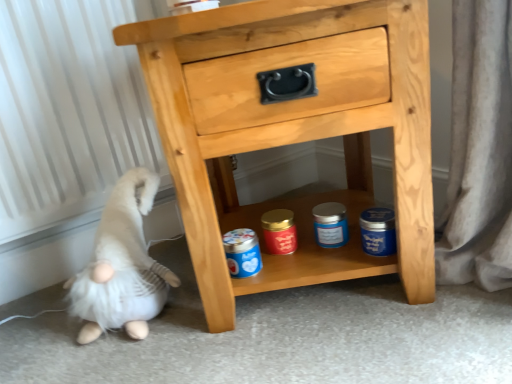
Question: Should I look upward or downward to see white plush gnome at lower left?

Choices:
 (A) down
 (B) up

Answer: (A)

Question: Is natural wood chest of drawers at center to the left of white plush gnome at lower left from the viewer's perspective?

Choices:
 (A) no
 (B) yes

Answer: (A)

Question: Considering the relative sizes of natural wood chest of drawers at center and white plush gnome at lower left in the image provided, is natural wood chest of drawers at center wider than white plush gnome at lower left?

Choices:
 (A) no
 (B) yes

Answer: (B)

Question: From a real-world perspective, is natural wood chest of drawers at center on top of white plush gnome at lower left?

Choices:
 (A) yes
 (B) no

Answer: (A)

Question: Is natural wood chest of drawers at center at the right side of white plush gnome at lower left?

Choices:
 (A) yes
 (B) no

Answer: (A)

Question: Could you tell me if natural wood chest of drawers at center is turned towards white plush gnome at lower left?

Choices:
 (A) yes
 (B) no

Answer: (B)

Question: Does natural wood chest of drawers at center have a larger size compared to white plush gnome at lower left?

Choices:
 (A) no
 (B) yes

Answer: (B)

Question: Is white plush gnome at lower left bigger than natural wood chest of drawers at center?

Choices:
 (A) no
 (B) yes

Answer: (A)

Question: Could you tell me if white plush gnome at lower left is turned towards natural wood chest of drawers at center?

Choices:
 (A) no
 (B) yes

Answer: (A)

Question: Can you confirm if white plush gnome at lower left is positioned to the left of natural wood chest of drawers at center?

Choices:
 (A) yes
 (B) no

Answer: (A)

Question: Does white plush gnome at lower left have a lesser width compared to natural wood chest of drawers at center?

Choices:
 (A) yes
 (B) no

Answer: (A)

Question: From a real-world perspective, is white plush gnome at lower left under natural wood chest of drawers at center?

Choices:
 (A) no
 (B) yes

Answer: (B)

Question: Is white plush gnome at lower left facing away from natural wood chest of drawers at center?

Choices:
 (A) no
 (B) yes

Answer: (A)

Question: Is white plush gnome at lower left situated inside natural wood chest of drawers at center or outside?

Choices:
 (A) outside
 (B) inside

Answer: (A)